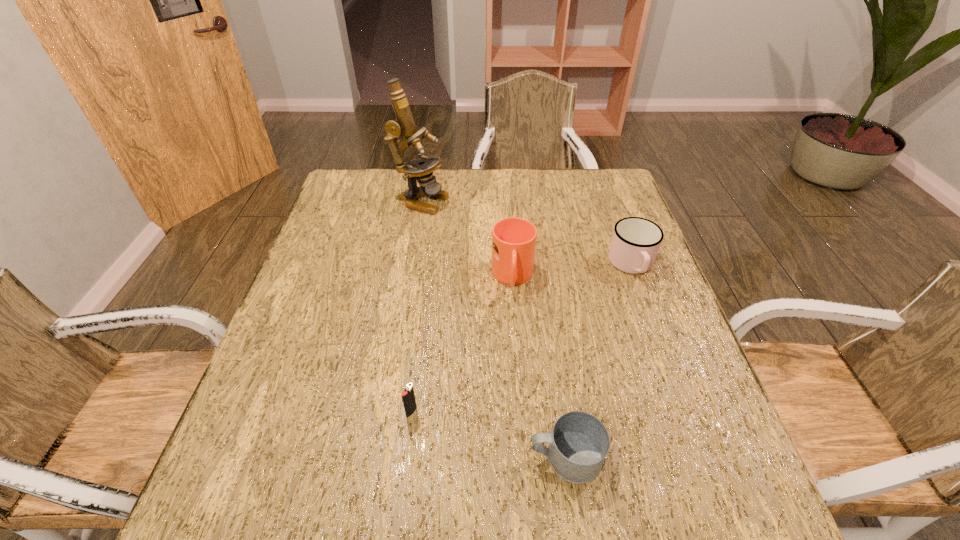
Locate an element on the screen. This screenshot has height=540, width=960. the tallest object is located at coordinates click(421, 169).

Where is `microscope`? The height and width of the screenshot is (540, 960). microscope is located at coordinates (421, 169).

Identify the location of the fourth shortest object. (514, 239).

Where is `the second tallest mug`? The height and width of the screenshot is (540, 960). the second tallest mug is located at coordinates (635, 243).

You are a GUI agent. You are given a task and a screenshot of the screen. Output one action in this format:
    pyautogui.click(x=<x>, y=<y>)
    Task: Click on the rightmost mug
    The image size is (960, 540).
    Given the screenshot: What is the action you would take?
    pyautogui.click(x=635, y=243)

Where is `igniter`? The width and height of the screenshot is (960, 540). igniter is located at coordinates (408, 397).

The image size is (960, 540). Find the location of `the nearest mug`. the nearest mug is located at coordinates (579, 442).

Identify the location of the shortest mug. (579, 442).

Find the location of a particular element. The image size is (960, 540). vacant space situated on the front of the farthest object is located at coordinates (410, 265).

Where is `vacant space situated on the handle side of the tallest mug`? vacant space situated on the handle side of the tallest mug is located at coordinates (523, 411).